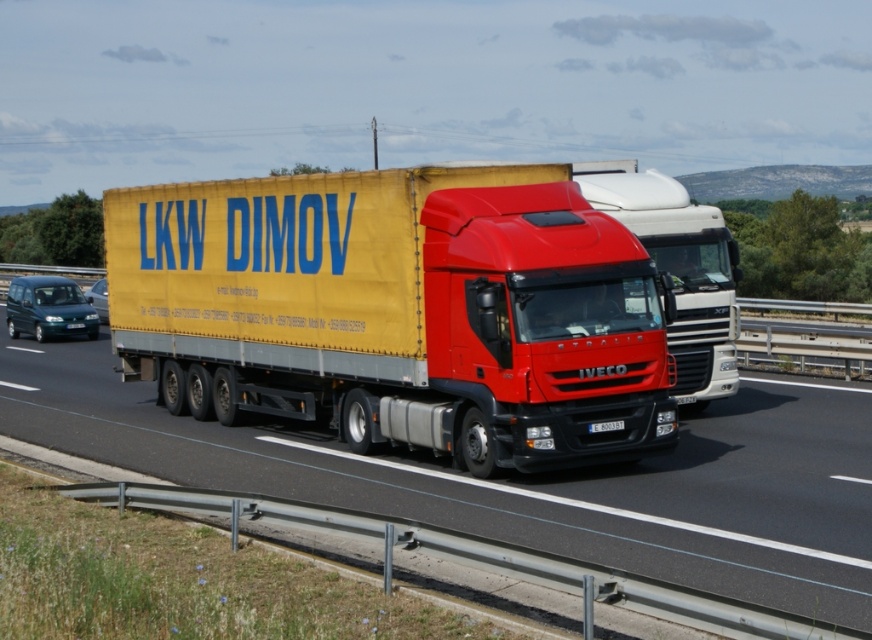
Question: Is red matte truck at center above teal glossy van at left?

Choices:
 (A) no
 (B) yes

Answer: (B)

Question: Which point is closer to the camera?

Choices:
 (A) red matte truck at center
 (B) metallic blue van at left
 (C) yellow fabric trailer at center
 (D) black plastic license plate at center

Answer: (C)

Question: Does yellow fabric trailer at center appear over teal glossy van at left?

Choices:
 (A) no
 (B) yes

Answer: (A)

Question: Which of the following is the closest to the observer?

Choices:
 (A) click(x=556, y=240)
 (B) click(x=67, y=332)
 (C) click(x=723, y=298)

Answer: (A)

Question: Is yellow fabric trailer at center below red matte truck at center?

Choices:
 (A) yes
 (B) no

Answer: (A)

Question: Which object is farther from the camera taking this photo?

Choices:
 (A) black plastic license plate at center
 (B) yellow fabric trailer truck at center

Answer: (A)